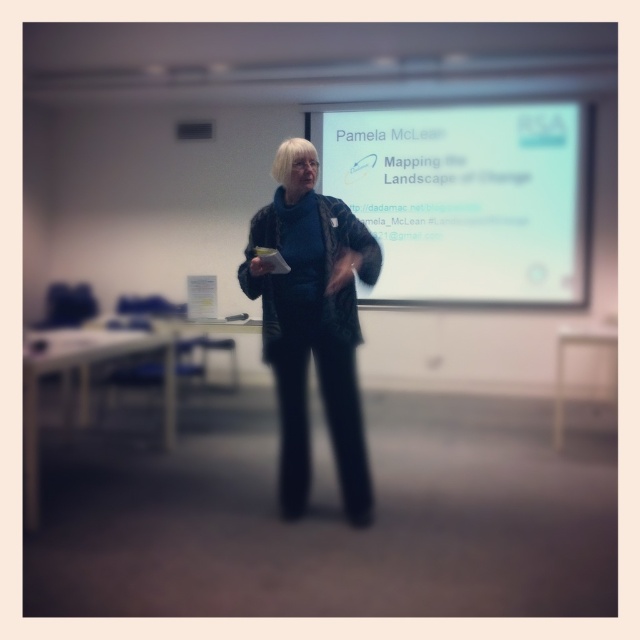
Question: Which point is closer to the camera taking this photo?

Choices:
 (A) (296, 490)
 (B) (428, 166)

Answer: (A)

Question: Which of the following is the closest to the observer?

Choices:
 (A) (356, 218)
 (B) (540, 211)

Answer: (A)

Question: Is white glossy projector screen at upper center positioned before black textured jacket at center?

Choices:
 (A) yes
 (B) no

Answer: (B)

Question: Among these objects, which one is nearest to the camera?

Choices:
 (A) black textured jacket at center
 (B) white glossy projector screen at upper center

Answer: (A)

Question: Observing the image, what is the correct spatial positioning of white glossy projector screen at upper center in reference to black textured jacket at center?

Choices:
 (A) right
 (B) left

Answer: (A)

Question: In this image, where is white glossy projector screen at upper center located relative to black textured jacket at center?

Choices:
 (A) left
 (B) right

Answer: (B)